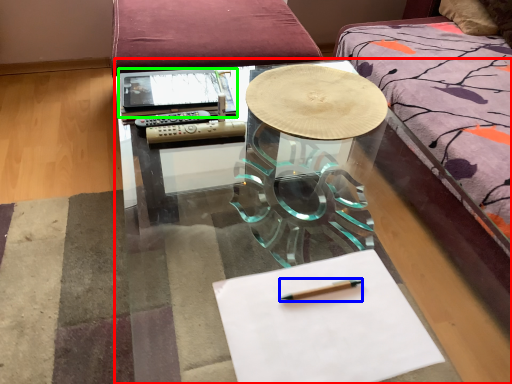
Question: Which is farther away from table (highlighted by a red box)? pencil (highlighted by a blue box) or notebook (highlighted by a green box)?

Choices:
 (A) pencil
 (B) notebook

Answer: (A)